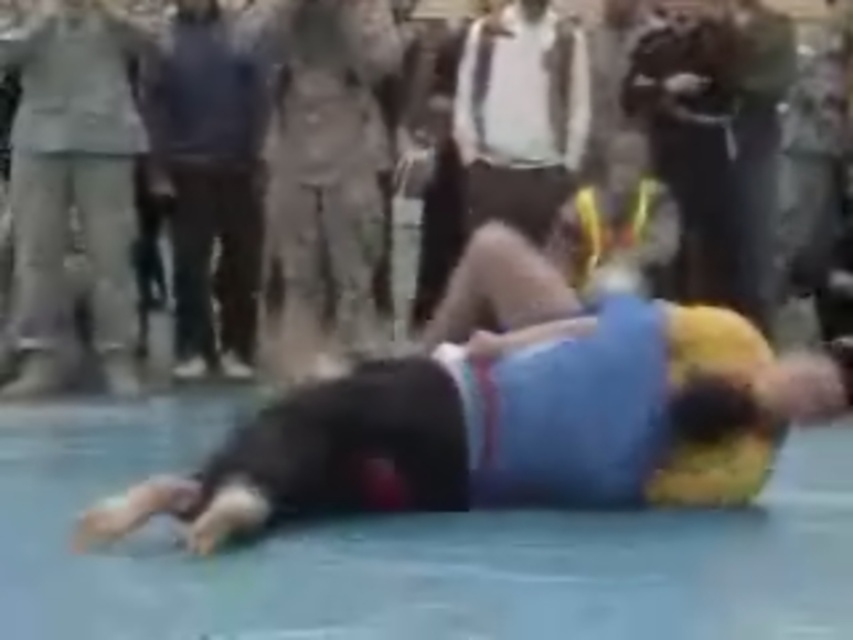
Question: Is blue fabric wrestler at center wider than dark blue shirt at center?

Choices:
 (A) no
 (B) yes

Answer: (B)

Question: Which point is closer to the camera?

Choices:
 (A) (219, 141)
 (B) (303, 74)
 (C) (550, 179)

Answer: (B)

Question: Which point appears closest to the camera in this image?

Choices:
 (A) (71, 317)
 (B) (369, 285)
 (C) (527, 60)

Answer: (C)

Question: In this image, where is dark blue shirt at center located relative to white shirt at center?

Choices:
 (A) below
 (B) above

Answer: (A)

Question: Among these points, which one is nearest to the camera?

Choices:
 (A) (726, 497)
 (B) (480, 68)
 (C) (61, 147)

Answer: (A)

Question: Does blue fabric wrestler at center have a greater width compared to dark blue shirt at center?

Choices:
 (A) no
 (B) yes

Answer: (B)